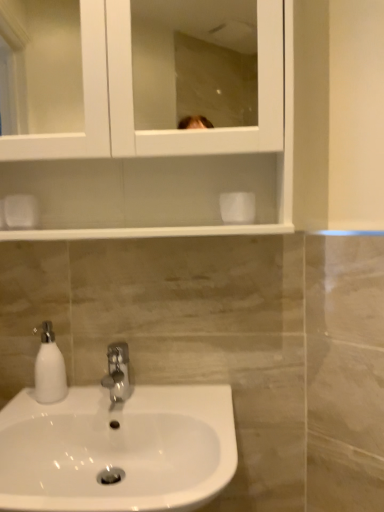
Identify the location of free region under white glossy medicine cabinet at upper center (from a real-world perspective). The height and width of the screenshot is (512, 384). (141, 396).